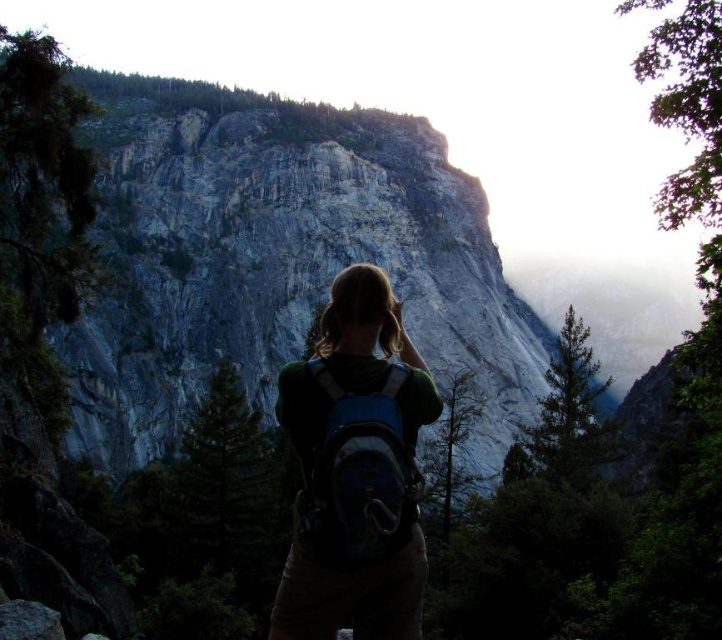
Question: Is green fabric backpack at center thinner than blue fabric backpack at center?

Choices:
 (A) yes
 (B) no

Answer: (B)

Question: Does green fabric backpack at center have a lesser width compared to blue fabric backpack at center?

Choices:
 (A) no
 (B) yes

Answer: (A)

Question: Which object appears farthest from the camera in this image?

Choices:
 (A) green fabric backpack at center
 (B) blue fabric backpack at center

Answer: (A)

Question: Does green fabric backpack at center have a larger size compared to blue fabric backpack at center?

Choices:
 (A) yes
 (B) no

Answer: (A)

Question: Among these points, which one is nearest to the camera?

Choices:
 (A) (343, 310)
 (B) (349, 429)

Answer: (B)